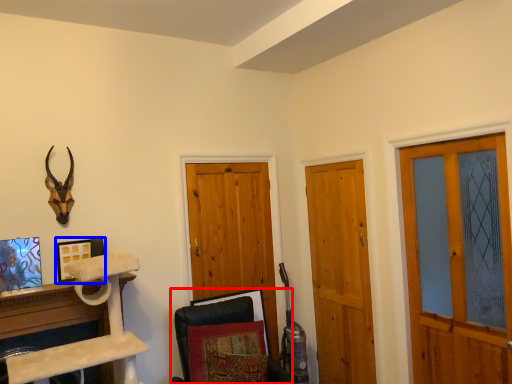
Question: Among these objects, which one is farthest to the camera, swivel chair (highlighted by a red box) or picture frame (highlighted by a blue box)?

Choices:
 (A) swivel chair
 (B) picture frame

Answer: (B)